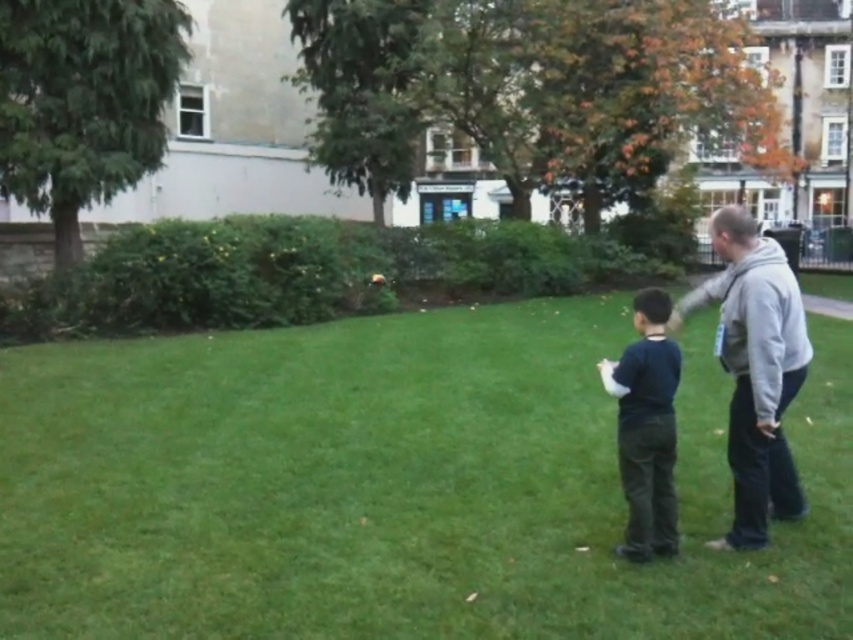
You are a photographer trying to capture the scene with a camera that has a limited field of view. You want to focus on the green grass at center and the dark blue shirt at center. Which object should you zoom in more on to ensure it takes up more space in your photo?

The dark blue shirt at center occupies more space than the green grass at center, so you should zoom in more on the dark blue shirt at center to ensure it takes up more space in your photo.

You are a photographer trying to capture a photo of the gray fleece jacket at right while ensuring the green grass at center is visible in the background. Based on their heights, will you need to adjust your camera angle upwards or downwards to include both in the frame?

The green grass at center is not as tall as the gray fleece jacket at right, so you will need to adjust your camera angle downwards to include both the gray fleece jacket at right and the green grass at center in the frame.

You are a delivery drone that needs to deliver a package to the dark blue shirt at center. The drone has a minimum safe distance requirement of 36 inches to avoid collisions. Can you safely land the drone on the green grass at center to deliver the package?

The distance between the green grass at center and dark blue shirt at center is 35.71 inches, which is less than the required 36 inches for safe landing. Therefore, the drone cannot land safely on the green grass at center due to insufficient distance from the dark blue shirt at center.